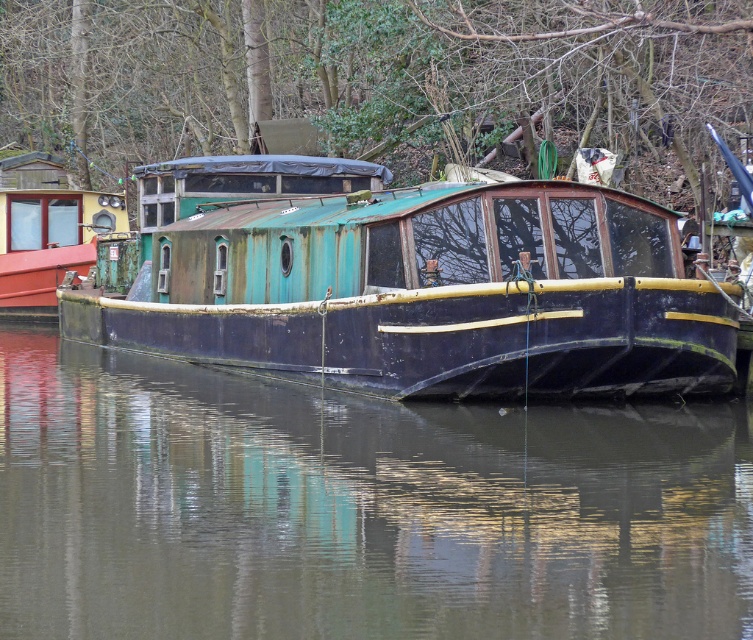
Between point (389, 609) and point (553, 260), which one is positioned in front?

Positioned in front is point (389, 609).

Can you confirm if smooth dark water at center is positioned to the right of rusty metal boat at center?

Yes, smooth dark water at center is to the right of rusty metal boat at center.

Is point (738, 452) less distant than point (398, 198)?

Yes, point (738, 452) is in front of point (398, 198).

Find the location of a particular element. smooth dark water at center is located at coordinates click(355, 508).

Consider the image. Which is more to the right, rusty metal boat at center or rusty metal boat at left?

rusty metal boat at center

Where is `rusty metal boat at center`? Image resolution: width=753 pixels, height=640 pixels. rusty metal boat at center is located at coordinates (407, 285).

What do you see at coordinates (355, 508) in the screenshot? The width and height of the screenshot is (753, 640). I see `smooth dark water at center` at bounding box center [355, 508].

Who is lower down, smooth dark water at center or rusty metal boat at left?

smooth dark water at center

I want to click on smooth dark water at center, so click(355, 508).

Locate an element on the screen. The height and width of the screenshot is (640, 753). smooth dark water at center is located at coordinates click(355, 508).